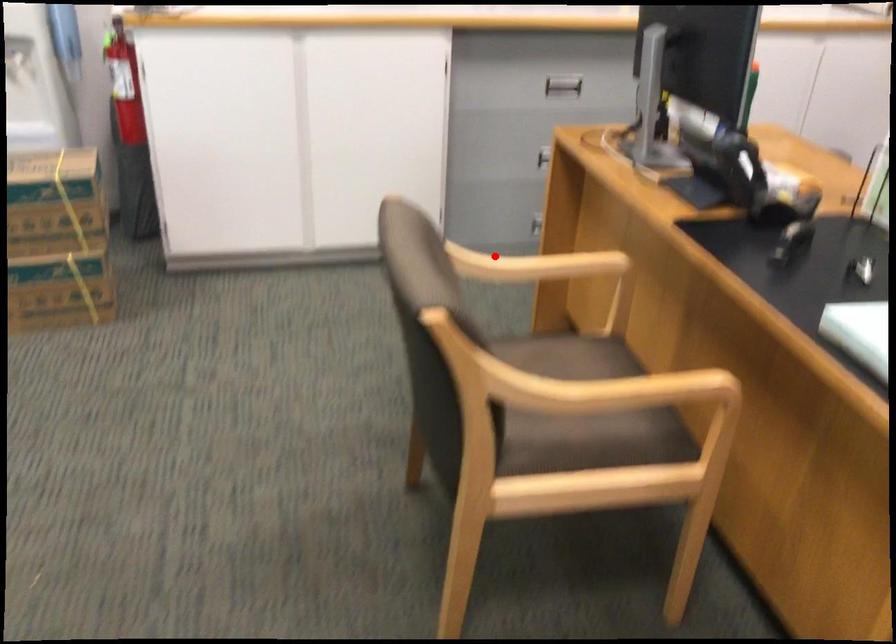
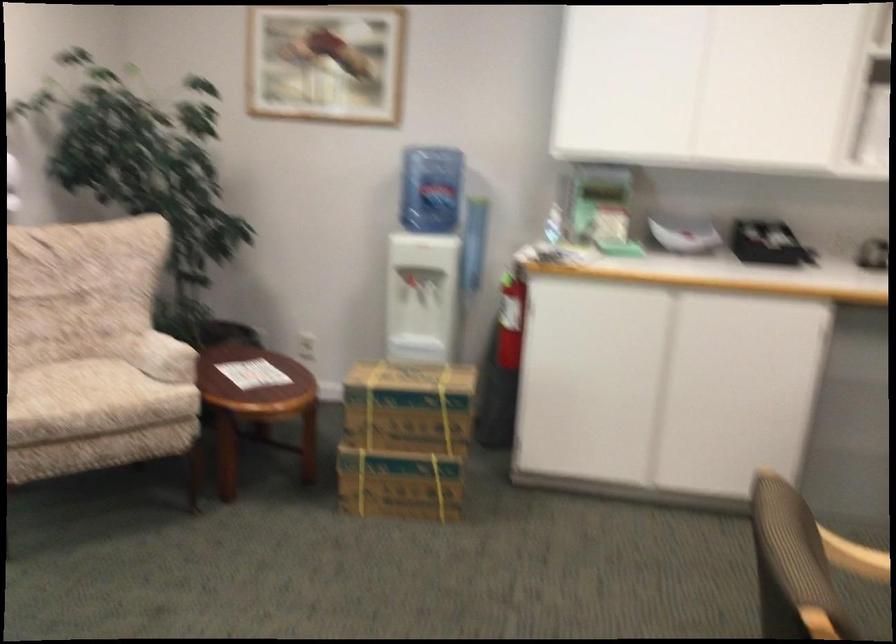
Question: I am providing you with two images of the same scene from different viewpoints. Image1 has a red point marked. In image2, the corresponding 3D location appears at what relative position? Reply with the corresponding letter.

Choices:
 (A) Closer
 (B) Farther

Answer: (A)